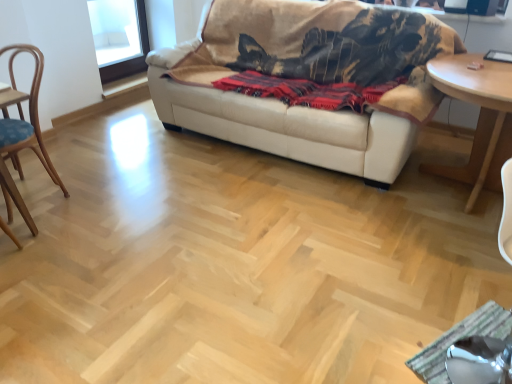
This screenshot has height=384, width=512. Identify the location of blank area beneath wooden chair at left (from a real-world perspective). (39, 192).